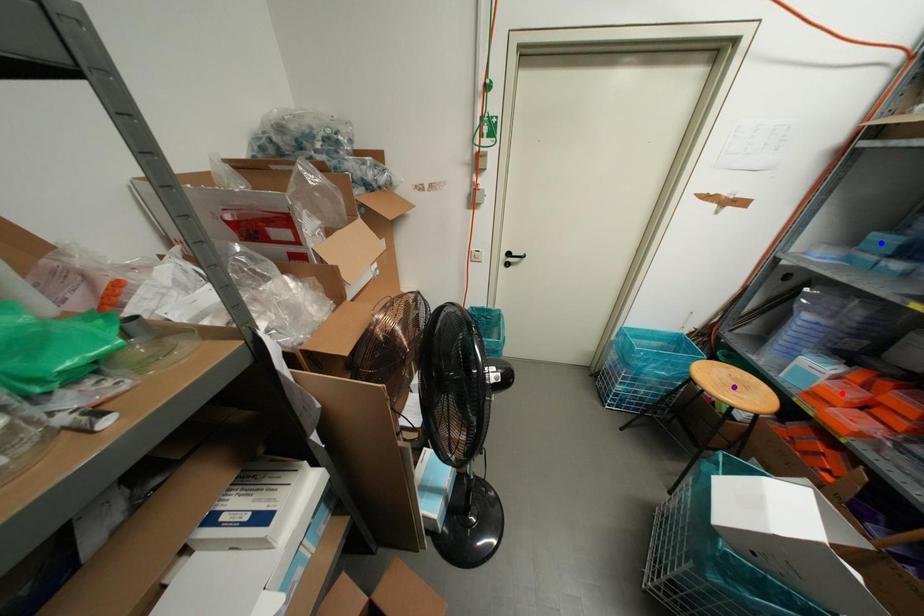
Order these from nearest to farthest:
blue point | red point | purple point

purple point
red point
blue point